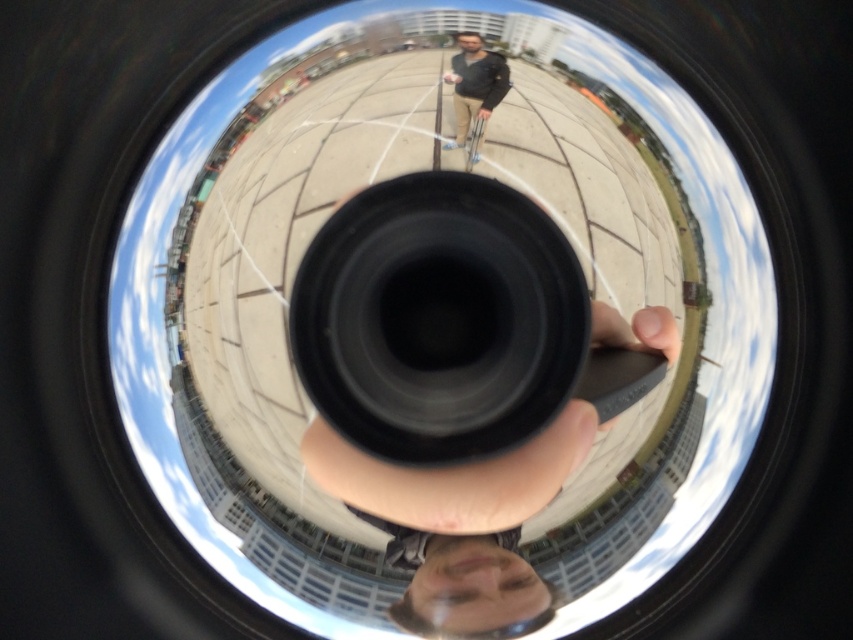
Is black matte hand at center shorter than dark gray jacket at center?

Incorrect, black matte hand at center's height does not fall short of dark gray jacket at center's.

Is black matte hand at center taller than dark gray jacket at center?

Correct, black matte hand at center is much taller as dark gray jacket at center.

Locate an element on the screen. black matte hand at center is located at coordinates (456, 477).

Locate an element on the screen. black matte hand at center is located at coordinates pyautogui.click(x=456, y=477).